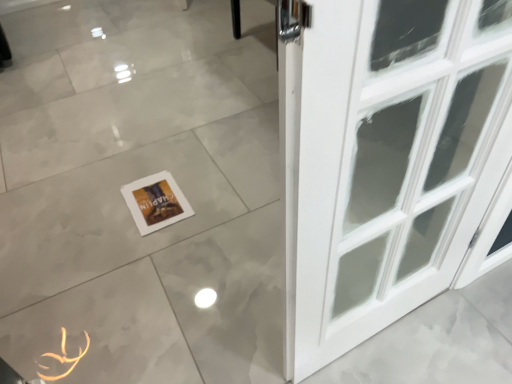
In order to click on free region on the left part of orange rubber band at lower left in this screenshot , I will do `click(19, 340)`.